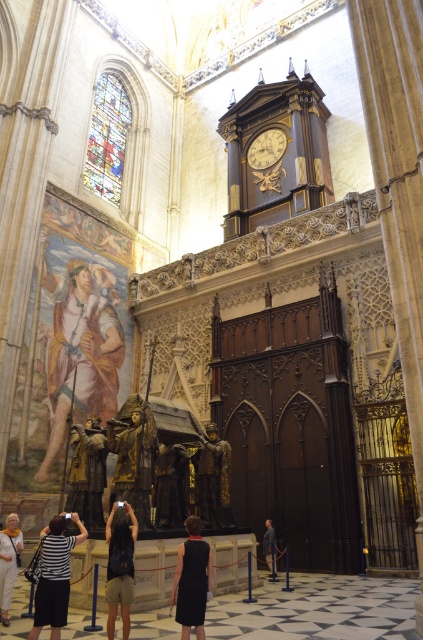
Does matte gold statue at center have a smaller size compared to gold textured statue at center?

Actually, matte gold statue at center might be larger than gold textured statue at center.

How far apart are matte gold statue at center and gold textured statue at center?

matte gold statue at center and gold textured statue at center are 11.43 meters apart.

Image resolution: width=423 pixels, height=640 pixels. I want to click on matte gold statue at center, so click(x=82, y=349).

Is point (128, 547) positioned before point (167, 449)?

Yes, it is in front of point (167, 449).

Who is positioned more to the left, dark brown leather jacket at center or polished bronze statue at center?

From the viewer's perspective, dark brown leather jacket at center appears more on the left side.

Between point (131, 518) and point (176, 456), which one is positioned in front?

Positioned in front is point (131, 518).

Identify the location of dark brown leather jacket at center. (120, 566).

Is matte gold statue at center to the right of black satin dress at center from the viewer's perspective?

In fact, matte gold statue at center is to the left of black satin dress at center.

What do you see at coordinates (82, 349) in the screenshot? I see `matte gold statue at center` at bounding box center [82, 349].

The height and width of the screenshot is (640, 423). Identify the location of matte gold statue at center. pyautogui.click(x=82, y=349).